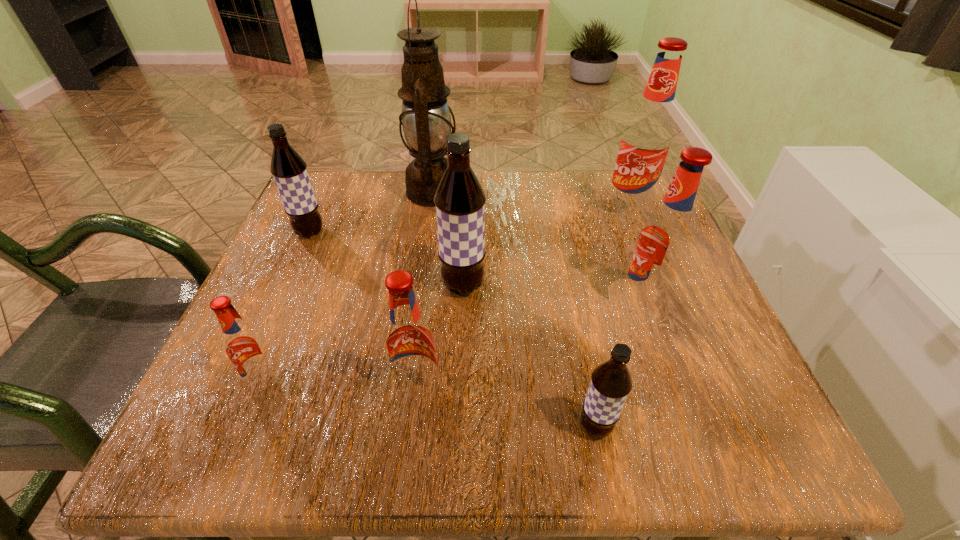
Identify the location of oil lamp. This screenshot has width=960, height=540. (426, 120).

The width and height of the screenshot is (960, 540). I want to click on the tallest root beer, so coord(647,138).

You are a GUI agent. You are given a task and a screenshot of the screen. Output one action in this format:
    pyautogui.click(x=<x>, y=<y>)
    Task: Click on the farthest red root beer
    This screenshot has width=960, height=540.
    Given the screenshot: What is the action you would take?
    point(647,138)

This screenshot has height=540, width=960. In order to click on the biggest brown root beer in this screenshot , I will do (x=459, y=200).

Where is `the second brown root beer from right to left`? This screenshot has height=540, width=960. the second brown root beer from right to left is located at coordinates (459, 200).

Image resolution: width=960 pixels, height=540 pixels. Find the location of `the third smallest red root beer`. the third smallest red root beer is located at coordinates (666, 240).

What are the coordinates of `the third red root beer from right to left` in the screenshot? It's located at (409, 343).

Find the location of `the farthest brown root beer`. the farthest brown root beer is located at coordinates (289, 170).

This screenshot has height=540, width=960. I want to click on the leftmost brown root beer, so click(289, 170).

Locate an element on the screen. the smallest red root beer is located at coordinates (245, 347).